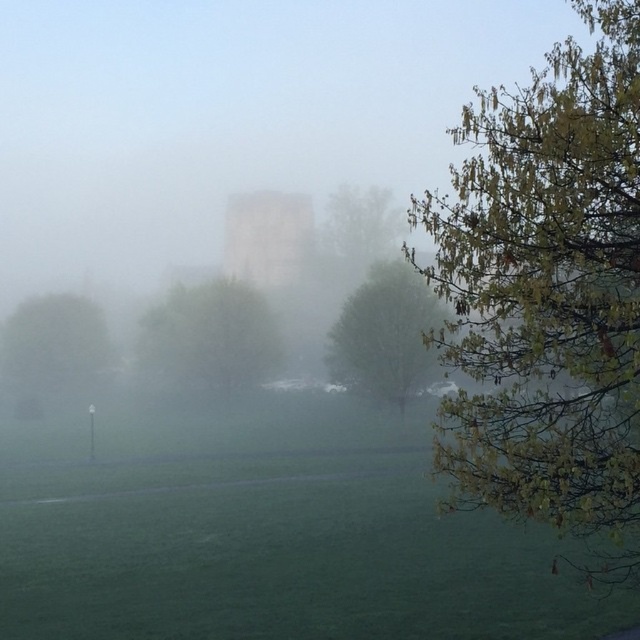
Does green leafy tree at upper right have a lesser height compared to green matte tree at left?

Incorrect, green leafy tree at upper right's height does not fall short of green matte tree at left's.

Is green leafy tree at upper right below green matte tree at left?

Incorrect, green leafy tree at upper right is not positioned below green matte tree at left.

Identify the location of green leafy tree at upper right. Image resolution: width=640 pixels, height=640 pixels. (385, 333).

Does green leafy tree at upper right have a lesser height compared to green leafy tree at center?

No.

What do you see at coordinates (385, 333) in the screenshot? I see `green leafy tree at upper right` at bounding box center [385, 333].

What do you see at coordinates (385, 333) in the screenshot?
I see `green leafy tree at upper right` at bounding box center [385, 333].

This screenshot has height=640, width=640. Identify the location of green leafy tree at upper right. (385, 333).

Is point (589, 180) more distant than point (12, 362)?

No, (589, 180) is closer to viewer.

Which is below, yellow-green leaves at right or green matte tree at left?

green matte tree at left is below.

Does point (602, 538) come farther from viewer compared to point (12, 340)?

No, (602, 538) is closer to viewer.

The width and height of the screenshot is (640, 640). What are the coordinates of `yellow-green leaves at right` in the screenshot? It's located at (547, 294).